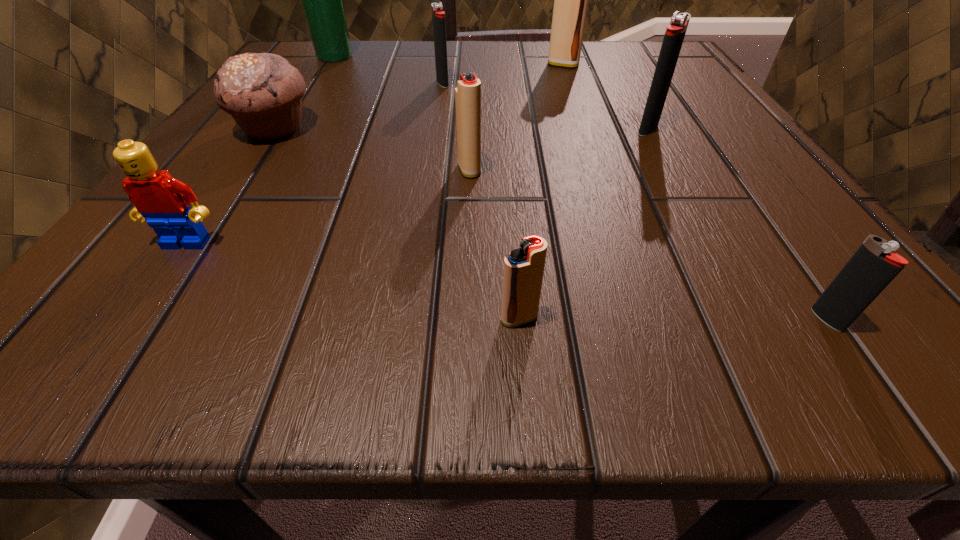
At what (x,y) coordinates should I click in order to perform the action: click on vacant space positioned on the back of the second smallest black igniter. Please return your answer as a coordinate pair (x, y). The height and width of the screenshot is (540, 960). Looking at the image, I should click on pos(445,65).

The height and width of the screenshot is (540, 960). What are the coordinates of `blank area located 0.240m on the front of the fourth nearest object` in the screenshot? It's located at (464, 339).

Where is `free location located on the front-facing side of the Lego`? This screenshot has width=960, height=540. free location located on the front-facing side of the Lego is located at coordinates (127, 330).

Locate an element on the screen. free space located 0.280m on the front of the muffin is located at coordinates (153, 312).

Image resolution: width=960 pixels, height=540 pixels. I want to click on free spot located on the back of the second red igniter from left to right, so click(504, 123).

Find the location of `vacant region located on the back of the smallest black igniter`. vacant region located on the back of the smallest black igniter is located at coordinates (752, 212).

The width and height of the screenshot is (960, 540). Identify the location of bottle located at the far edge. [322, 0].

You are a GUI agent. You are given a task and a screenshot of the screen. Output one action in this format:
    pyautogui.click(x=<x>, y=<y>)
    Task: Click on the bottle located at the left edge
    This screenshot has height=540, width=960.
    Given the screenshot: What is the action you would take?
    pyautogui.click(x=322, y=0)

Where is `Lego that is at the left edge`? The width and height of the screenshot is (960, 540). Lego that is at the left edge is located at coordinates (162, 200).

You are a GUI agent. You are given a task and a screenshot of the screen. Output one action in this format:
    pyautogui.click(x=<x>, y=<y>)
    Task: Click on the muffin present at the left edge
    The image size is (960, 540).
    Given the screenshot: What is the action you would take?
    pyautogui.click(x=263, y=92)